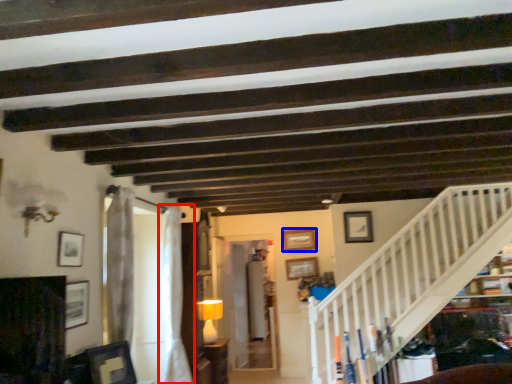
Question: Which of the following is the farthest to the observer, curtain (highlighted by a red box) or picture frame (highlighted by a blue box)?

Choices:
 (A) curtain
 (B) picture frame

Answer: (B)